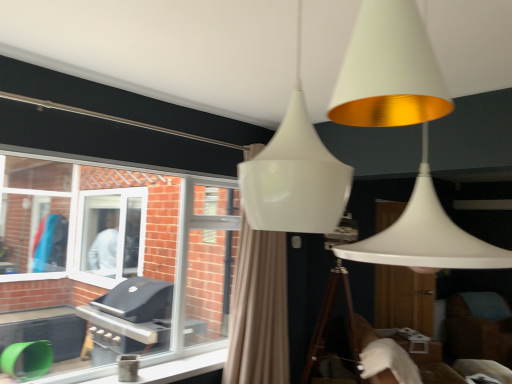
At what (x,y) coordinates should I click in order to perform the action: click on clear glass window at left. Please return your answer as a coordinate pair (x, y). This screenshot has height=384, width=512. Looking at the image, I should click on (119, 252).

Does point (20, 248) come farther from viewer compared to point (474, 333)?

No, (20, 248) is in front of (474, 333).

From the image's perspective, which one is positioned higher, clear glass window at left or brown fabric swivel chair at lower right?

clear glass window at left appears higher in the image.

In the scene shown: Is clear glass window at left facing towards brown fabric swivel chair at lower right?

No, clear glass window at left is not facing towards brown fabric swivel chair at lower right.

Which is more to the right, clear glass window at left or brown fabric swivel chair at lower right?

brown fabric swivel chair at lower right.

Looking at this image, is clear glass window at left a part of beige fabric curtain at center?

No.

Is beige fabric curtain at center facing away from clear glass window at left?

Result: Yes, beige fabric curtain at center is facing away from clear glass window at left.

Would you consider beige fabric curtain at center to be distant from clear glass window at left?

Absolutely, beige fabric curtain at center is distant from clear glass window at left.

Is beige fabric curtain at center wider or thinner than clear glass window at left?

Clearly, beige fabric curtain at center has more width compared to clear glass window at left.

Is beige fabric curtain at center a part of brown fabric swivel chair at lower right?

No.

Is brown fabric swivel chair at lower right at the right side of beige fabric curtain at center?

Indeed, brown fabric swivel chair at lower right is positioned on the right side of beige fabric curtain at center.

Is point (480, 346) positioned before point (248, 276)?

No.

From the image's perspective, is brown fabric swivel chair at lower right positioned above or below beige fabric curtain at center?

brown fabric swivel chair at lower right is situated lower than beige fabric curtain at center in the image.

Is brown fabric swivel chair at lower right at the left side of clear glass window at left?

No.

From a real-world perspective, which object stands above the other?

clear glass window at left is physically above.

Find the location of a particular element. The height and width of the screenshot is (384, 512). window located on the left of brown fabric swivel chair at lower right is located at coordinates (119, 252).

From the image's perspective, is brown fabric swivel chair at lower right located above clear glass window at left?

Incorrect, from the image's perspective, brown fabric swivel chair at lower right is lower than clear glass window at left.

Is beige fabric curtain at center with brown fabric swivel chair at lower right?

No, beige fabric curtain at center is not in contact with brown fabric swivel chair at lower right.

Based on their positions, is beige fabric curtain at center located to the left or right of brown fabric swivel chair at lower right?

beige fabric curtain at center is to the left of brown fabric swivel chair at lower right.

In order to click on curtain above the brown fabric swivel chair at lower right (from the image's perspective) in this screenshot , I will do `click(258, 310)`.

Is point (273, 378) closer to camera compared to point (470, 313)?

That is True.

From a real-world perspective, is clear glass window at left below beige fabric curtain at center?

No.

Can you confirm if clear glass window at left is bigger than beige fabric curtain at center?

No, clear glass window at left is not bigger than beige fabric curtain at center.

Consider the image. Are clear glass window at left and beige fabric curtain at center located far from each other?

Indeed, clear glass window at left is not near beige fabric curtain at center.

Identify the location of window in front of the brown fabric swivel chair at lower right. (119, 252).

Image resolution: width=512 pixels, height=384 pixels. Identify the location of curtain behind the clear glass window at left. (258, 310).

Considering their positions, is brown fabric swivel chair at lower right positioned further to clear glass window at left than beige fabric curtain at center?

The object further to clear glass window at left is brown fabric swivel chair at lower right.

When comparing their distances from brown fabric swivel chair at lower right, does clear glass window at left or beige fabric curtain at center seem further?

clear glass window at left is positioned further to the anchor brown fabric swivel chair at lower right.

Considering their positions, is brown fabric swivel chair at lower right positioned closer to beige fabric curtain at center than clear glass window at left?

clear glass window at left is closer to beige fabric curtain at center.

Consider the image. Estimate the real-world distances between objects in this image. Which object is closer to clear glass window at left, beige fabric curtain at center or brown fabric swivel chair at lower right?

beige fabric curtain at center.

Which object lies further to the anchor point beige fabric curtain at center, clear glass window at left or brown fabric swivel chair at lower right?

brown fabric swivel chair at lower right lies further to beige fabric curtain at center than the other object.

Estimate the real-world distances between objects in this image. Which object is further from brown fabric swivel chair at lower right, beige fabric curtain at center or clear glass window at left?

clear glass window at left.

Find the location of a particular element. Image resolution: width=512 pixels, height=384 pixels. curtain between clear glass window at left and brown fabric swivel chair at lower right in the horizontal direction is located at coordinates (258, 310).